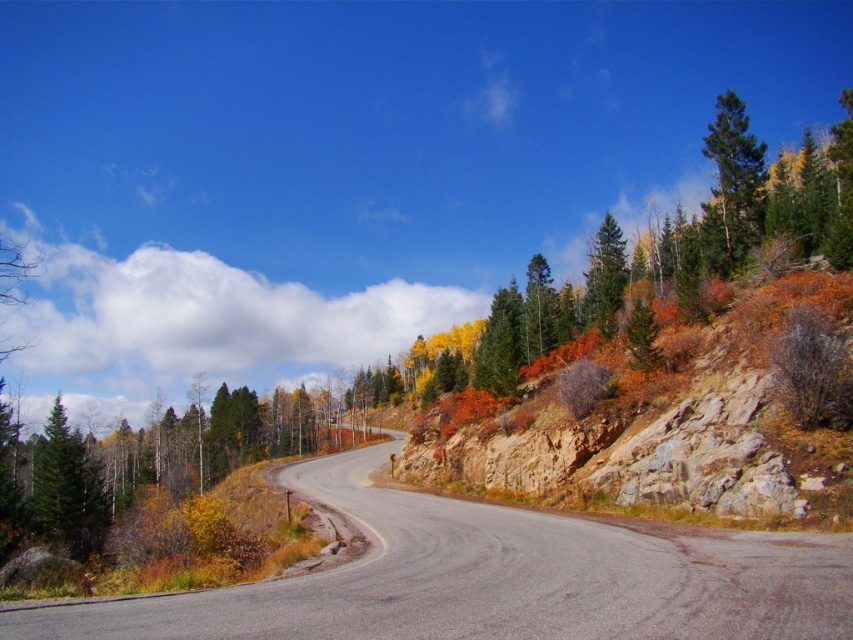
Question: Which of the following is the closest to the observer?

Choices:
 (A) (51, 540)
 (B) (614, 292)

Answer: (A)

Question: Which object is closer to the camera taking this photo?

Choices:
 (A) green matte tree at upper right
 (B) autumn foliage at right

Answer: (B)

Question: Can you confirm if autumn foliage at right is positioned below green matte tree at left?

Choices:
 (A) no
 (B) yes

Answer: (A)

Question: Which point is closer to the camera taking this photo?

Choices:
 (A) (67, 467)
 (B) (578, 520)
 (C) (616, 276)

Answer: (B)

Question: Does asphalt road at center appear on the right side of green matte tree at upper center?

Choices:
 (A) yes
 (B) no

Answer: (B)

Question: Considering the relative positions of green matte tree at upper right and green matte tree at upper center in the image provided, where is green matte tree at upper right located with respect to green matte tree at upper center?

Choices:
 (A) left
 (B) right

Answer: (B)